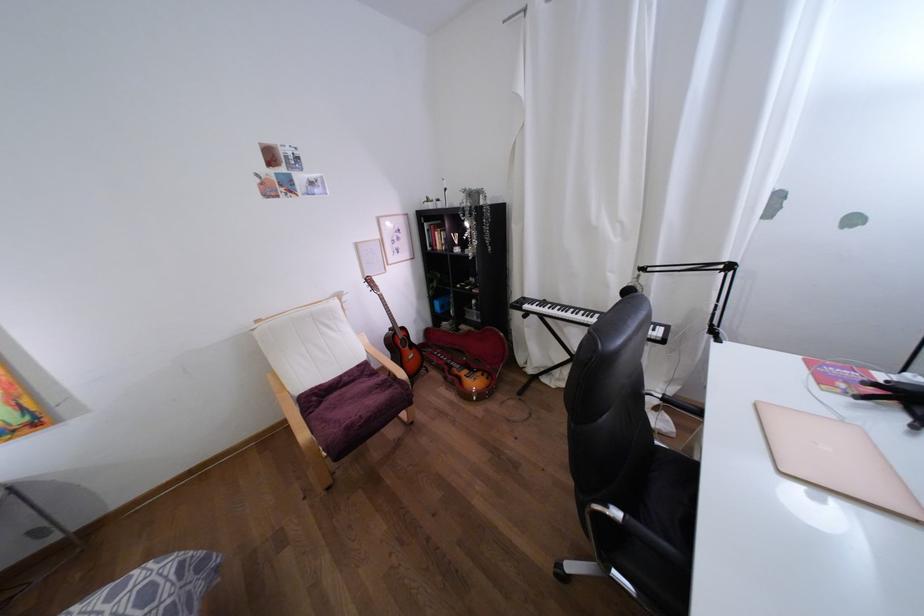
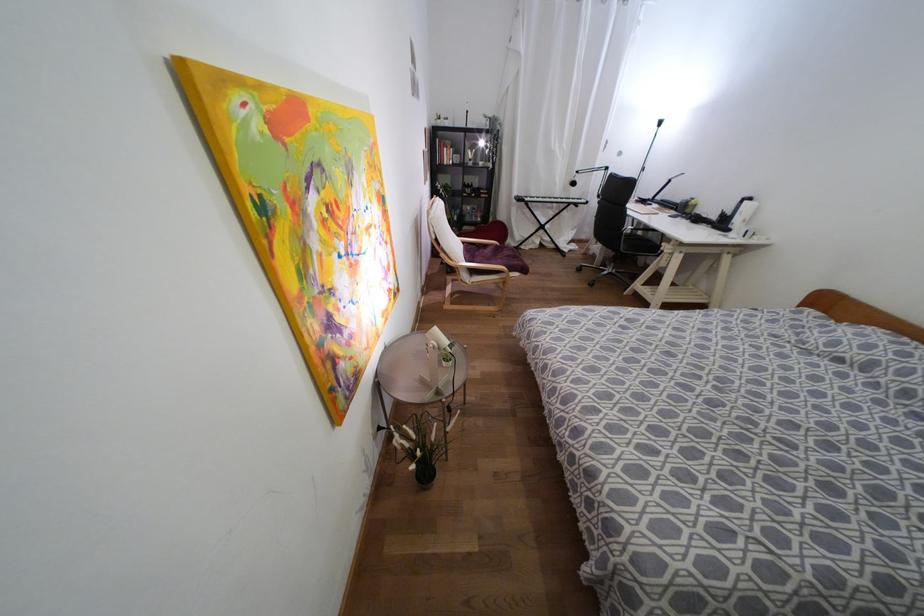
Where in the second image is the point corresponding to point 438,246 from the first image?

(444, 161)